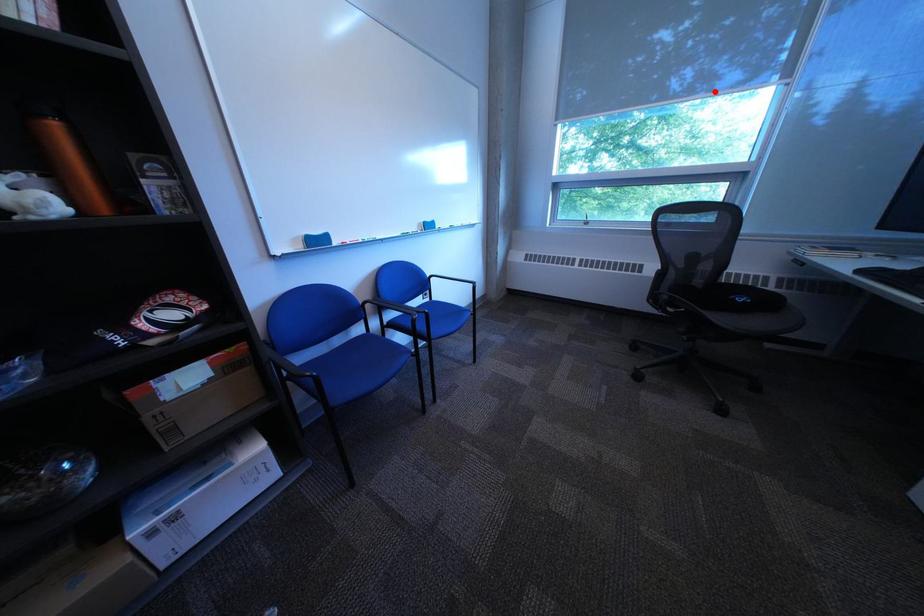
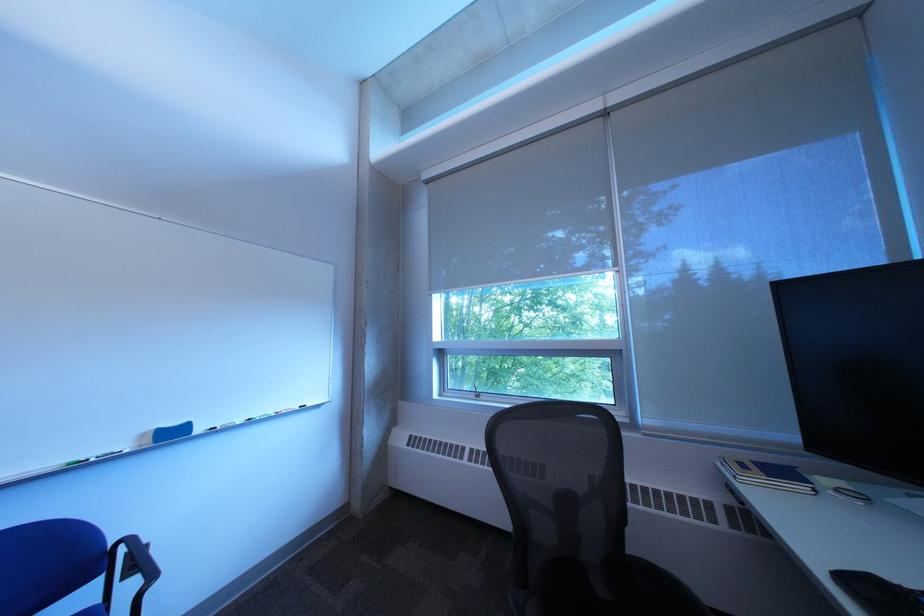
Question: I am providing you with two images of the same scene from different viewpoints. Image1 has a red point marked. In image2, the corresponding 3D location appears at what relative position? Reply with the corresponding letter.

Choices:
 (A) Closer
 (B) Farther

Answer: (A)